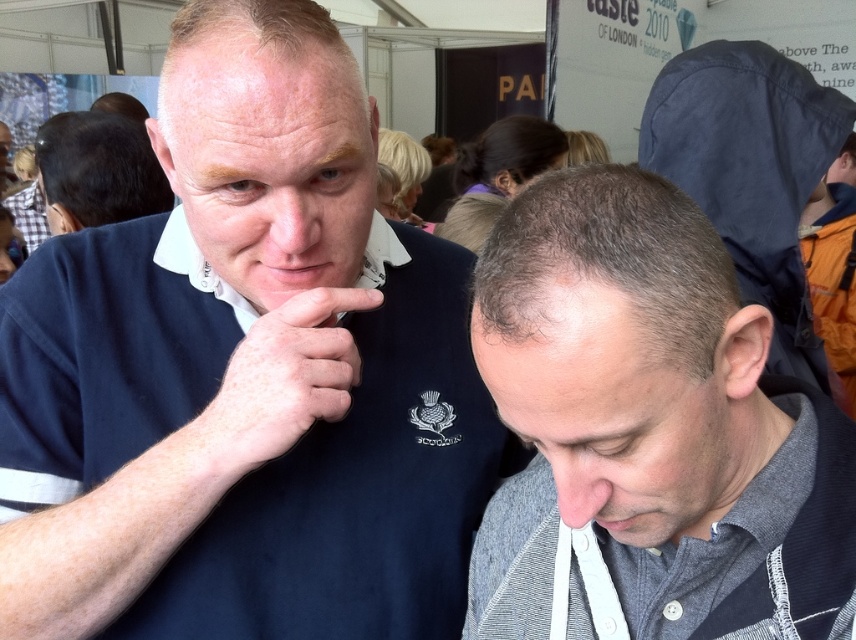
Question: Does gray striped polo shirt at lower right lie behind pink matte nose at lower center?

Choices:
 (A) no
 (B) yes

Answer: (A)

Question: Can you confirm if pale skin/hair at center is positioned below matte skin nose at center?

Choices:
 (A) no
 (B) yes

Answer: (B)

Question: Which point appears farthest from the camera in this image?

Choices:
 (A) (10, 426)
 (B) (241, 449)
 (C) (272, 189)
 (D) (572, 474)

Answer: (A)

Question: Which object is positioned closest to the gray striped polo shirt at lower right?

Choices:
 (A) pale skin/hair at center
 (B) dark blue polo shirt at upper left
 (C) black matte hair at upper left

Answer: (B)

Question: Which point is closer to the camera taking this photo?

Choices:
 (A) (664, 547)
 (B) (107, 113)

Answer: (A)

Question: Is the position of gray striped polo shirt at lower right less distant than that of matte skin nose at center?

Choices:
 (A) yes
 (B) no

Answer: (A)